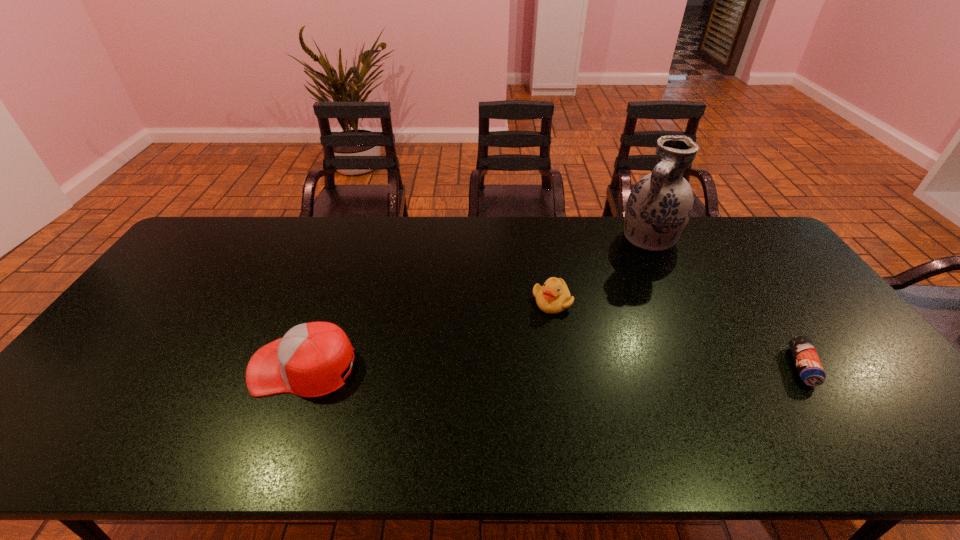
Locate an element on the screen. The image size is (960, 540). free space on the desktop that is between the leftmost object and the rightmost object and is positioned on the front-facing side of the duckling is located at coordinates (550, 367).

Identify the location of free space on the desktop that is between the second tallest object and the beer can and is positioned with the handle on the side of the tallest object. (558, 367).